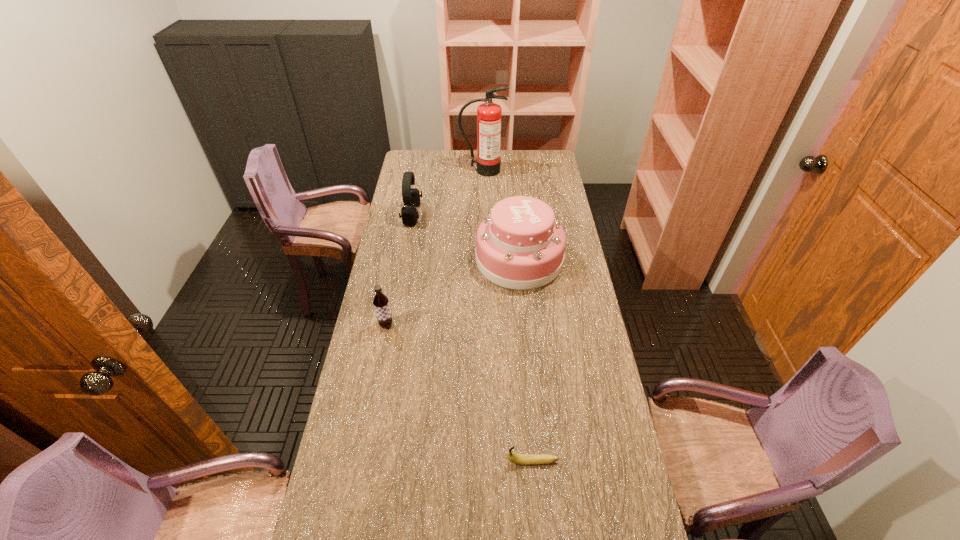
Identify the location of vacant space located on the right of the root beer. Image resolution: width=960 pixels, height=540 pixels. (491, 325).

Image resolution: width=960 pixels, height=540 pixels. I want to click on blank space located 0.280m at the stem of the nearest object, so click(x=405, y=461).

Locate an element on the screen. This screenshot has height=540, width=960. vacant space situated 0.230m at the stem of the nearest object is located at coordinates (423, 461).

At what (x,y) coordinates should I click in order to perform the action: click on vacant space located 0.090m at the stem of the nearest object. Please return your answer as a coordinate pair (x, y). The height and width of the screenshot is (540, 960). Looking at the image, I should click on (474, 461).

In order to click on object located in the far edge section of the desktop in this screenshot , I will do `click(489, 115)`.

Locate an element on the screen. headset positioned at the left edge is located at coordinates (411, 196).

The height and width of the screenshot is (540, 960). What are the coordinates of `root beer that is at the left edge` in the screenshot? It's located at (381, 302).

Where is `object at the right edge`? The image size is (960, 540). object at the right edge is located at coordinates (520, 246).

Where is `vacant space at the far edge`? Image resolution: width=960 pixels, height=540 pixels. vacant space at the far edge is located at coordinates (507, 152).

I want to click on vacant area at the left edge of the desktop, so click(x=366, y=444).